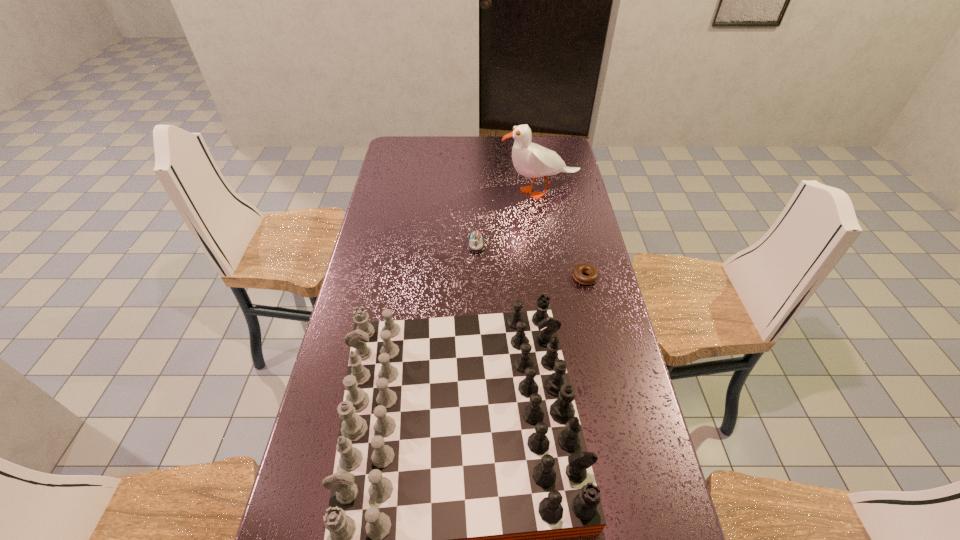
Image resolution: width=960 pixels, height=540 pixels. I want to click on doughnut at the right edge, so click(x=593, y=273).

Image resolution: width=960 pixels, height=540 pixels. In order to click on free space at the far edge in this screenshot , I will do `click(459, 152)`.

Where is `vacant space at the left edge`? This screenshot has width=960, height=540. vacant space at the left edge is located at coordinates (392, 265).

Where is `blank space at the right edge of the desktop`? blank space at the right edge of the desktop is located at coordinates (607, 480).

You are a GUI agent. You are given a task and a screenshot of the screen. Output one action in this format:
    pyautogui.click(x=<x>, y=<y>)
    Task: Click on the vacant space at the far right corner of the desktop
    Image resolution: width=960 pixels, height=540 pixels.
    Given the screenshot: What is the action you would take?
    pyautogui.click(x=548, y=136)

The height and width of the screenshot is (540, 960). Find the location of `free spot between the second nearest object and the second farthest object`. free spot between the second nearest object and the second farthest object is located at coordinates (531, 261).

Locate an element on the screen. The width and height of the screenshot is (960, 540). vacant area between the farthest object and the third nearest object is located at coordinates (508, 218).

Locate an element on the screen. This screenshot has width=960, height=540. vacant space in between the gull and the doughnut is located at coordinates (563, 234).

Where is `vacant space that is in between the doughnut and the farthest object`? This screenshot has width=960, height=540. vacant space that is in between the doughnut and the farthest object is located at coordinates (563, 234).

I want to click on vacant area between the computer mouse and the tallest object, so coord(508,218).